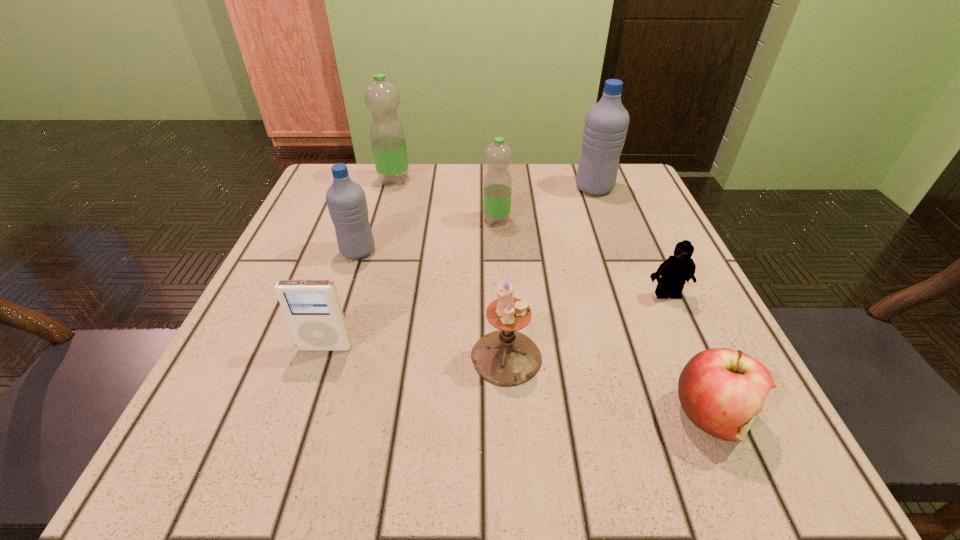
Locate an element on the screen. This screenshot has height=540, width=960. free spot between the bigger green water bottle and the smaller green water bottle is located at coordinates (445, 200).

This screenshot has height=540, width=960. In order to click on free space between the apple and the left blue water bottle in this screenshot , I will do `click(535, 333)`.

The height and width of the screenshot is (540, 960). I want to click on object that is the fourth closest to the smaller green water bottle, so click(506, 357).

Identify which object is the fifth closest to the left green water bottle. Please provide its 2D coordinates. Your answer should be formatted as a tuple, i.e. [(x, y)], where the tuple contains the x and y coordinates of a point satisfying the conditions above.

[(506, 357)]

Find the location of a particular element. water bottle that can be found as the third closest to the Lego is located at coordinates (346, 200).

At what (x,y) coordinates should I click in order to perform the action: click on water bottle that is the second closest one to the left green water bottle. Please return your answer as a coordinate pair (x, y). Looking at the image, I should click on (346, 200).

Locate an element on the screen. This screenshot has width=960, height=540. vacant point that satisfies the following two spatial constraints: 1. on the front-facing side of the apple; 2. on the right side of the third shortest object is located at coordinates (303, 416).